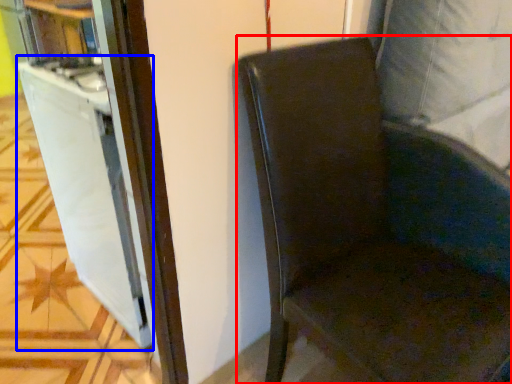
Question: Which of the following is the closest to the observer, chair (highlighted by a red box) or file cabinet (highlighted by a blue box)?

Choices:
 (A) chair
 (B) file cabinet

Answer: (A)